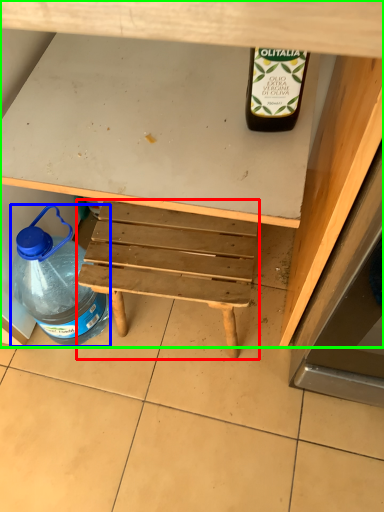
Question: Which object is the closest to the stool (highlighted by a red box)? Choose among these: bottle (highlighted by a blue box) or desk (highlighted by a green box).

Choices:
 (A) bottle
 (B) desk

Answer: (A)